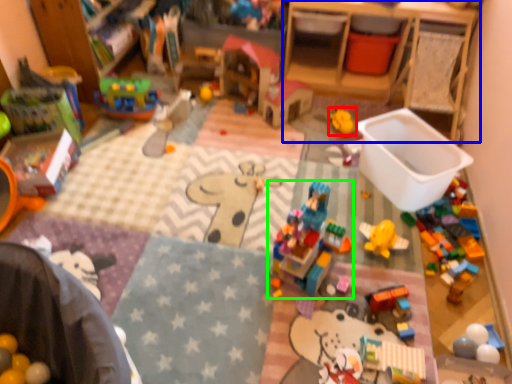
Question: Which object is positioned closest to toy (highlighted by a red box)? Select from changing table (highlighted by a blue box) and toy (highlighted by a green box).

Choices:
 (A) changing table
 (B) toy

Answer: (A)